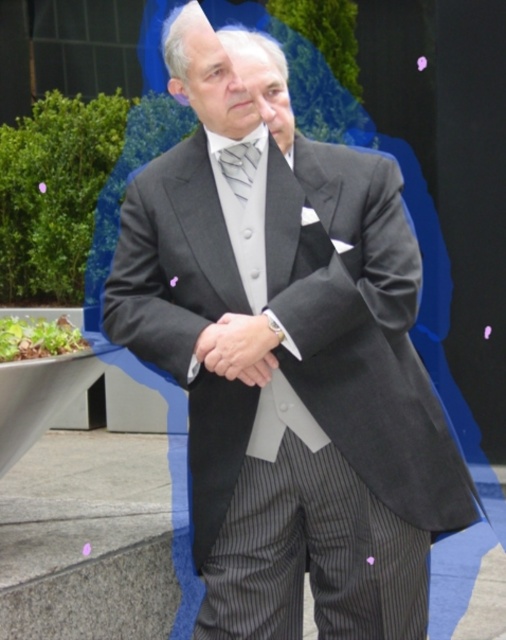
Does smooth gray suit at center have a lesser width compared to silvery metallic tie at center?

No, smooth gray suit at center is not thinner than silvery metallic tie at center.

Which is behind, point (229, 346) or point (233, 188)?

The point (233, 188) is behind.

Identify the location of smooth gray suit at center. click(x=238, y=348).